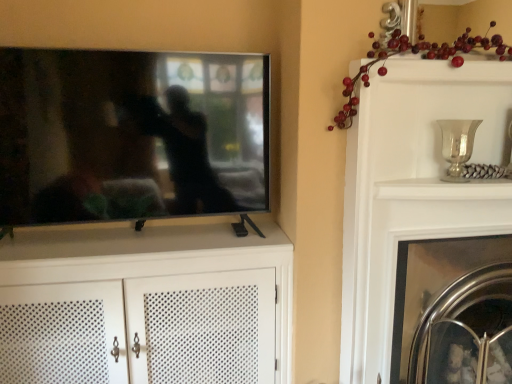
Question: Does glossy red berries at upper right have a greater height compared to flat screen tv at left?

Choices:
 (A) no
 (B) yes

Answer: (A)

Question: Is glossy red berries at upper right closer to camera compared to flat screen tv at left?

Choices:
 (A) no
 (B) yes

Answer: (B)

Question: From the image's perspective, is glossy red berries at upper right over flat screen tv at left?

Choices:
 (A) yes
 (B) no

Answer: (A)

Question: Is glossy red berries at upper right thinner than flat screen tv at left?

Choices:
 (A) no
 (B) yes

Answer: (A)

Question: From a real-world perspective, is glossy red berries at upper right positioned over flat screen tv at left based on gravity?

Choices:
 (A) no
 (B) yes

Answer: (B)

Question: Considering the positions of point (468, 362) and point (379, 44), is point (468, 362) closer or farther from the camera than point (379, 44)?

Choices:
 (A) closer
 (B) farther

Answer: (B)

Question: From their relative heights in the image, would you say clear glass fireplace screen at center-right is taller or shorter than glossy red berries at upper right?

Choices:
 (A) tall
 (B) short

Answer: (B)

Question: Looking at their shapes, would you say clear glass fireplace screen at center-right is wider or thinner than glossy red berries at upper right?

Choices:
 (A) wide
 (B) thin

Answer: (A)

Question: Which is correct: clear glass fireplace screen at center-right is inside glossy red berries at upper right, or outside of it?

Choices:
 (A) inside
 (B) outside

Answer: (B)

Question: Relative to silver metallic vase at upper right, is clear glass fireplace screen at center-right in front or behind?

Choices:
 (A) behind
 (B) front

Answer: (A)

Question: From a real-world perspective, is clear glass fireplace screen at center-right positioned above or below silver metallic vase at upper right?

Choices:
 (A) below
 (B) above

Answer: (A)

Question: Is clear glass fireplace screen at center-right spatially inside silver metallic vase at upper right, or outside of it?

Choices:
 (A) inside
 (B) outside

Answer: (B)

Question: Visually, is clear glass fireplace screen at center-right positioned to the left or to the right of silver metallic vase at upper right?

Choices:
 (A) left
 (B) right

Answer: (B)

Question: Would you say flat screen tv at left is to the left or to the right of silver metallic vase at upper right in the picture?

Choices:
 (A) right
 (B) left

Answer: (B)

Question: Is flat screen tv at left wider or thinner than silver metallic vase at upper right?

Choices:
 (A) wide
 (B) thin

Answer: (A)